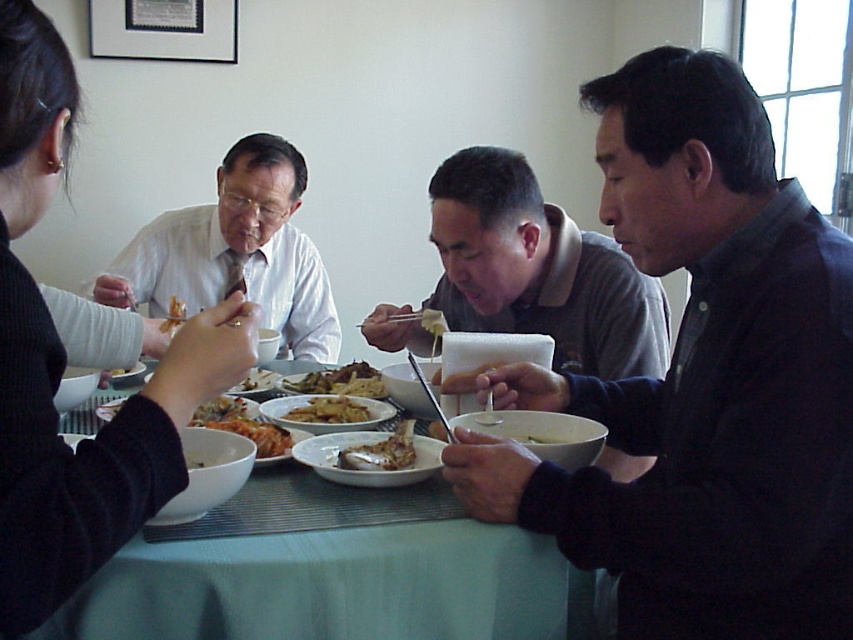
Question: Is gray matte shirt at center smaller than brown textured meat at center?

Choices:
 (A) no
 (B) yes

Answer: (A)

Question: Where is gray matte shirt at center located in relation to white matte rice at center in the image?

Choices:
 (A) left
 (B) right

Answer: (B)

Question: Which point is farther to the camera?

Choices:
 (A) golden fried chicken at center
 (B) brown textured meat at center
 (C) black matte shirt at upper left

Answer: (B)

Question: Considering the real-world distances, which object is farthest from the white matte rice at center?

Choices:
 (A) white shirt at upper left
 (B) slightly browned bread at upper left
 (C) dark gray sweater at right
 (D) black matte shirt at upper left

Answer: (D)

Question: Does black matte shirt at upper left have a larger size compared to white glossy bone at center?

Choices:
 (A) no
 (B) yes

Answer: (B)

Question: Which point is farther to the camera?

Choices:
 (A) (238, 381)
 (B) (427, 314)

Answer: (B)